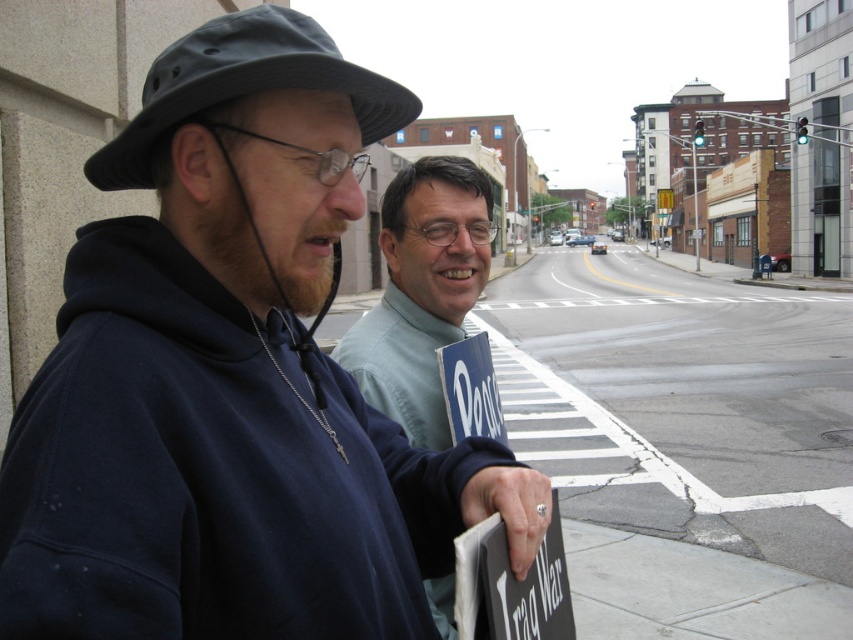
You are a photographer trying to capture both the dark blue hoodie at left and the light blue shirt at center in a single frame. Based on their sizes, which one should you position closer to the camera to ensure both appear balanced in the photo?

The dark blue hoodie at left is bigger than the light blue shirt at center, so to balance their sizes in the photo, position the light blue shirt at center closer to the camera while keeping the dark blue hoodie at left farther back.

You are a delivery robot with a 60 cm wide package. You need to move between the light blue shirt at center and the dark gray fabric fedora at left. Is there enough space for your package?

The distance between the light blue shirt at center and the dark gray fabric fedora at left is 70.14 centimeters. Since your package is 60 cm wide, there is enough space to pass through.

You are a delivery person with a box that is 8 inches wide. You need to pass between the dark blue hoodie at left and the dark gray fabric fedora at left. Can your box fit through the space between them?

The distance between the dark blue hoodie at left and the dark gray fabric fedora at left is 7.70 inches. Since the box is 8 inches wide, it cannot fit through the space between them.